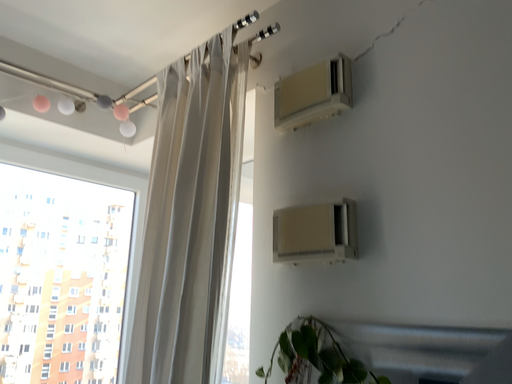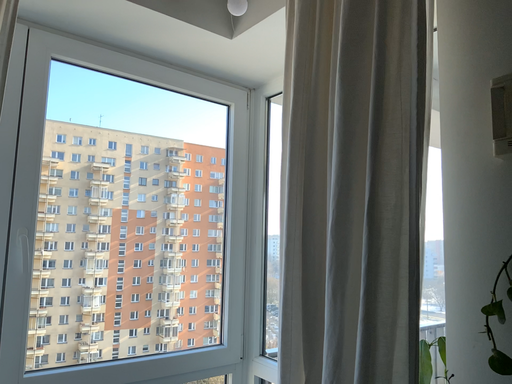
Question: How did the camera likely rotate when shooting the video?

Choices:
 (A) rotated right
 (B) rotated left

Answer: (B)